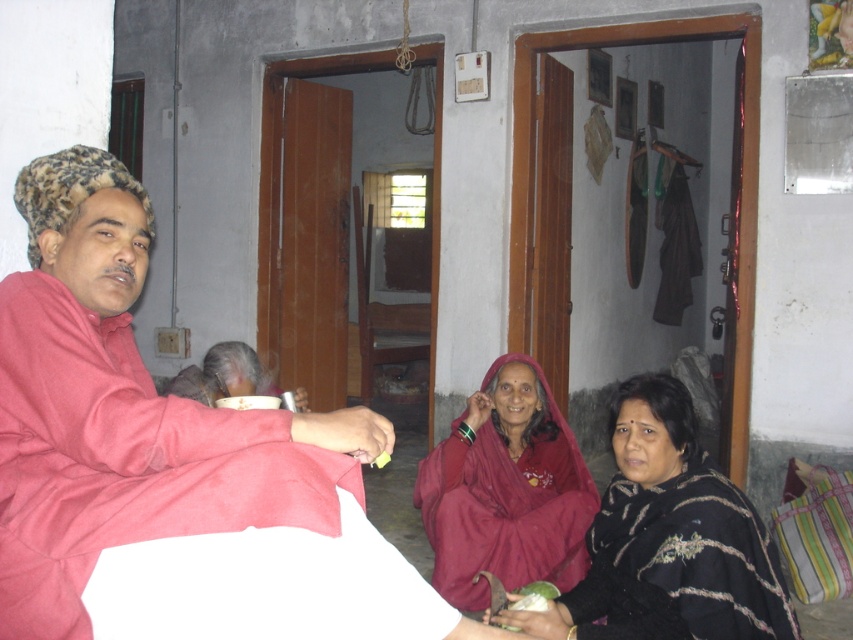
Who is lower down, black textured shawl at lower right or maroon fabric shawl at center?

Positioned lower is maroon fabric shawl at center.

Between point (636, 420) and point (469, 444), which one is positioned in front?

Point (636, 420) is more forward.

Find the location of a particular element. The height and width of the screenshot is (640, 853). black textured shawl at lower right is located at coordinates (669, 538).

Does point (282, 445) come closer to viewer compared to point (451, 529)?

Yes.

Which is above, red cotton kurta at left or maroon fabric shawl at center?

red cotton kurta at left is above.

Locate an element on the screen. The height and width of the screenshot is (640, 853). red cotton kurta at left is located at coordinates (167, 461).

Between red cotton kurta at left and black textured shawl at lower right, which one has more height?

red cotton kurta at left

The image size is (853, 640). What do you see at coordinates (167, 461) in the screenshot?
I see `red cotton kurta at left` at bounding box center [167, 461].

Between point (170, 461) and point (648, 387), which one is positioned behind?

Point (648, 387)

Locate an element on the screen. The image size is (853, 640). red cotton kurta at left is located at coordinates (167, 461).